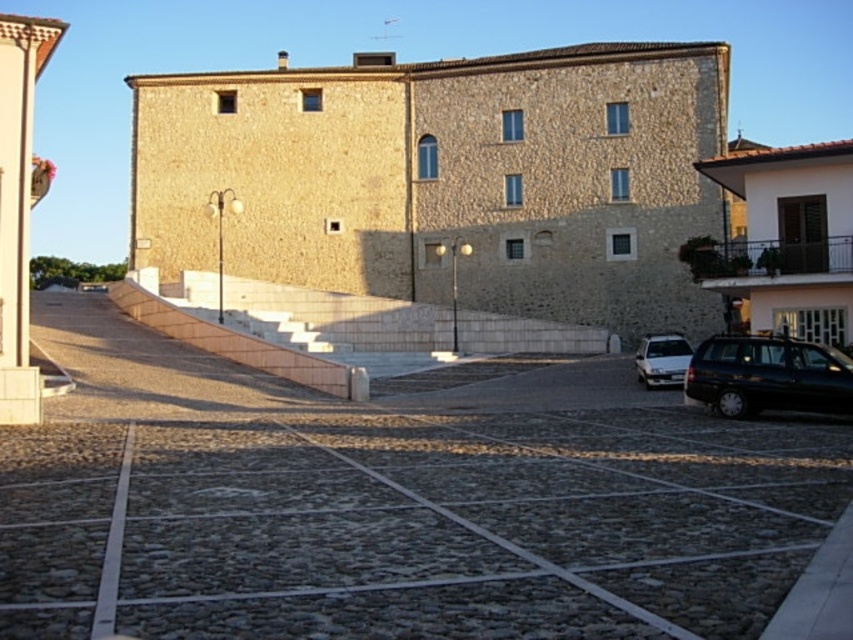
Question: Which object is positioned closest to the shiny black car at lower right?

Choices:
 (A) metallic black balustrade at upper right
 (B) silver metallic sedan at lower right

Answer: (A)

Question: Which object is positioned farthest from the cobblestone parking lot at center?

Choices:
 (A) silver metallic sedan at lower right
 (B) metallic black balustrade at upper right
 (C) shiny black car at lower right

Answer: (A)

Question: Is cobblestone parking lot at center above metallic black balustrade at upper right?

Choices:
 (A) yes
 (B) no

Answer: (B)

Question: Which object is positioned closest to the metallic black balustrade at upper right?

Choices:
 (A) silver metallic sedan at lower right
 (B) shiny black car at lower right

Answer: (A)

Question: Can you confirm if cobblestone parking lot at center is positioned to the right of metallic black balustrade at upper right?

Choices:
 (A) no
 (B) yes

Answer: (A)

Question: Does cobblestone parking lot at center appear under metallic black balustrade at upper right?

Choices:
 (A) no
 (B) yes

Answer: (B)